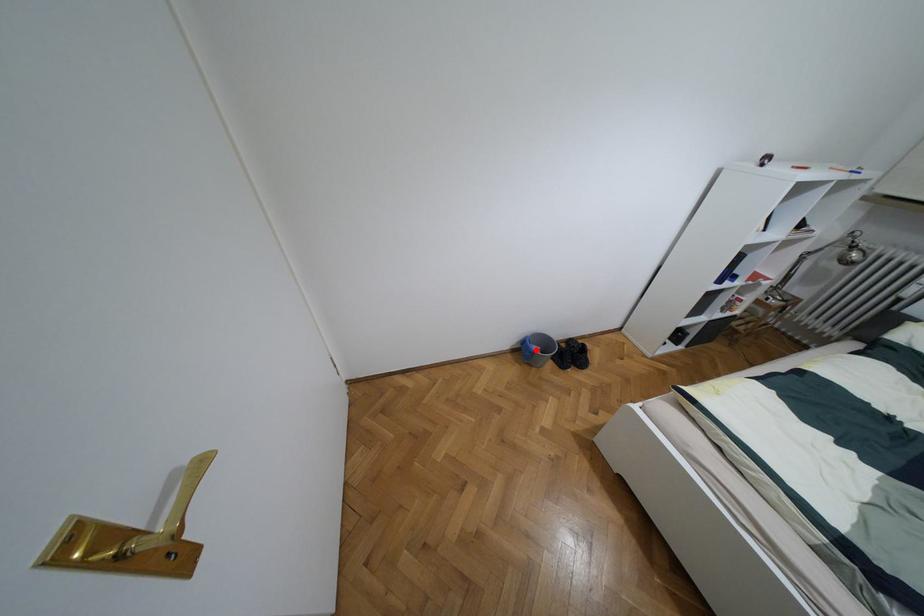
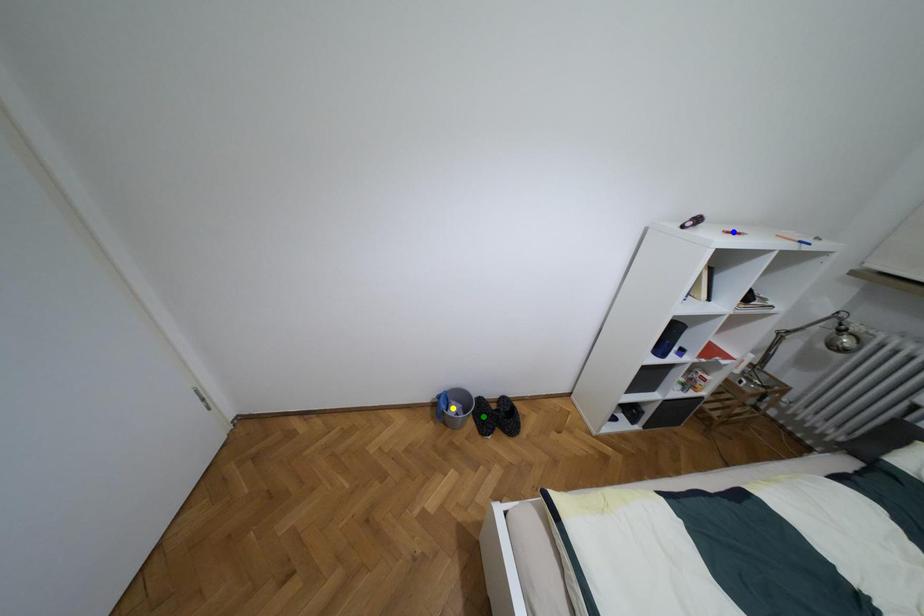
Question: I am providing you with two images of the same scene from different viewpoints. A red point is marked on the first image. You are given multiple points on the second image. Which mark in image 2 goes with the point in image 1?

Choices:
 (A) green point
 (B) blue point
 (C) yellow point

Answer: (C)